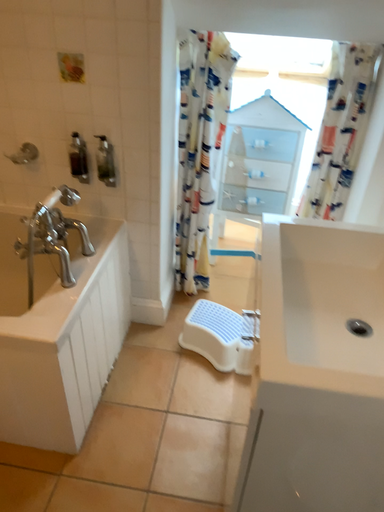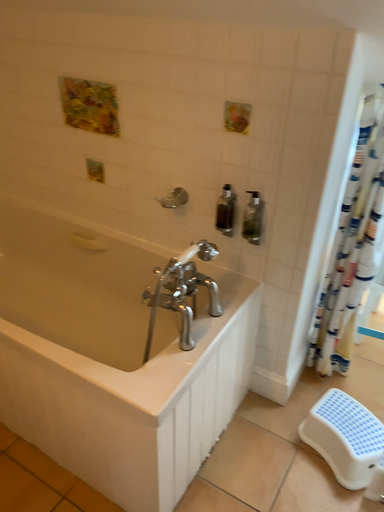
Question: Which way did the camera rotate in the video?

Choices:
 (A) rotated right
 (B) rotated left

Answer: (B)